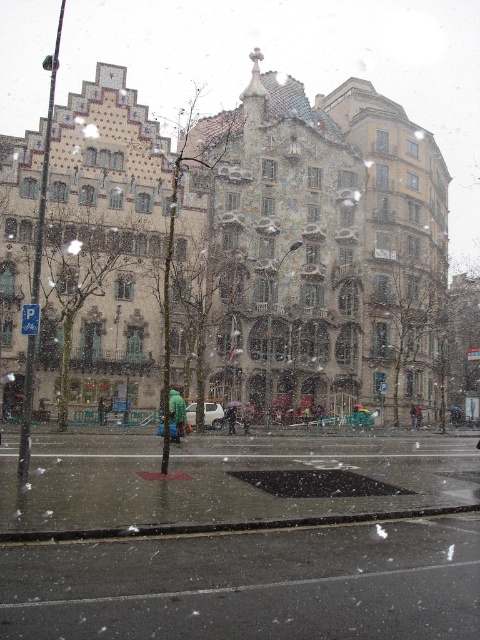
Question: Is green fuzzy coat at center wider than transparent plastic umbrella at center?

Choices:
 (A) no
 (B) yes

Answer: (B)

Question: Which of the following is the closest to the observer?

Choices:
 (A) transparent plastic umbrella at center
 (B) green fuzzy coat at center

Answer: (B)

Question: Does green fuzzy coat at center have a larger size compared to transparent plastic umbrella at center?

Choices:
 (A) no
 (B) yes

Answer: (B)

Question: Does green fuzzy coat at center appear over transparent plastic umbrella at center?

Choices:
 (A) no
 (B) yes

Answer: (B)

Question: Which object appears farthest from the camera in this image?

Choices:
 (A) transparent plastic umbrella at center
 (B) green fuzzy coat at center

Answer: (A)